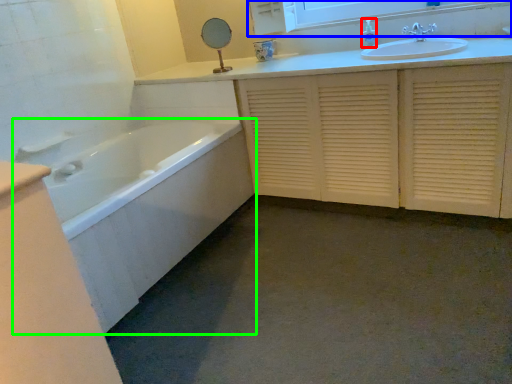
Question: Based on their relative distances, which object is farther from toiletry (highlighted by a red box)? Choose from medicine cabinet (highlighted by a blue box) and bathtub (highlighted by a green box).

Choices:
 (A) medicine cabinet
 (B) bathtub

Answer: (B)